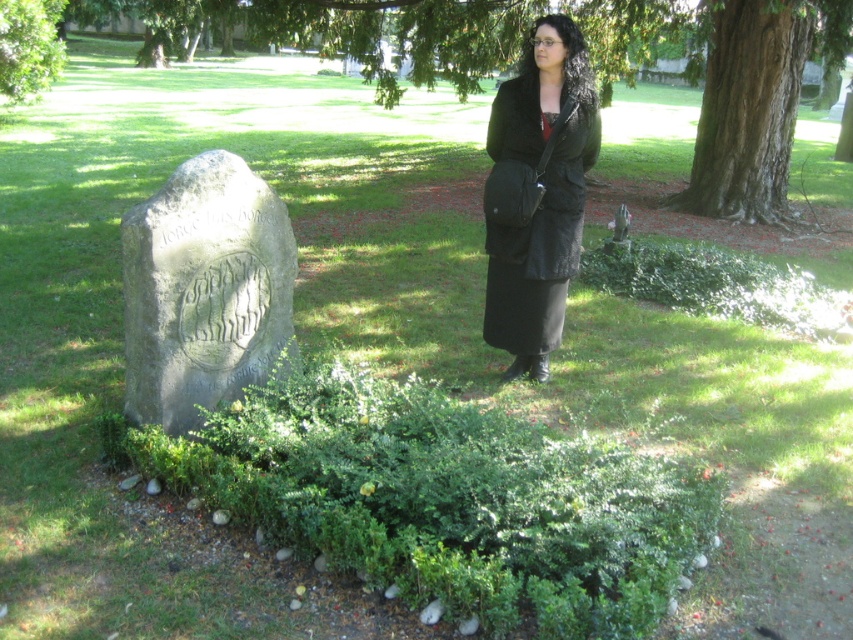
Is gray stone gravestone at left to the right of smooth brown bark at upper right from the viewer's perspective?

In fact, gray stone gravestone at left is to the left of smooth brown bark at upper right.

Locate an element on the screen. The image size is (853, 640). gray stone gravestone at left is located at coordinates (202, 289).

Is point (573, 227) positioned in front of point (759, 138)?

Yes, it is.

Where is `black leather jacket at center`? This screenshot has width=853, height=640. black leather jacket at center is located at coordinates (543, 195).

Who is positioned more to the left, smooth brown bark at upper right or green leafy tree at upper left?

Positioned to the left is green leafy tree at upper left.

Is point (782, 145) positioned before point (21, 90)?

Yes.

Is point (810, 42) less distant than point (57, 16)?

Yes, it is in front of point (57, 16).

The image size is (853, 640). I want to click on smooth brown bark at upper right, so click(x=756, y=100).